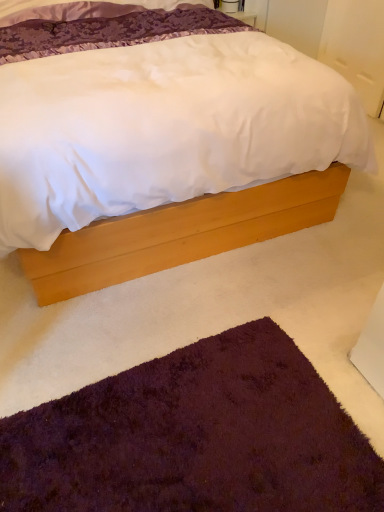
Question: In the image, is light wood bed at center positioned in front of or behind purple shaggy rug at lower left?

Choices:
 (A) behind
 (B) front

Answer: (B)

Question: Is light wood bed at center to the left or to the right of purple shaggy rug at lower left in the image?

Choices:
 (A) right
 (B) left

Answer: (B)

Question: Is light wood bed at center inside the boundaries of purple shaggy rug at lower left, or outside?

Choices:
 (A) outside
 (B) inside

Answer: (A)

Question: From the image's perspective, is purple shaggy rug at lower left above or below light wood bed at center?

Choices:
 (A) above
 (B) below

Answer: (B)

Question: Would you say purple shaggy rug at lower left is to the left or to the right of light wood bed at center in the picture?

Choices:
 (A) left
 (B) right

Answer: (B)

Question: Is purple shaggy rug at lower left in front of or behind light wood bed at center in the image?

Choices:
 (A) front
 (B) behind

Answer: (B)

Question: Is purple shaggy rug at lower left wider or thinner than light wood bed at center?

Choices:
 (A) thin
 (B) wide

Answer: (A)